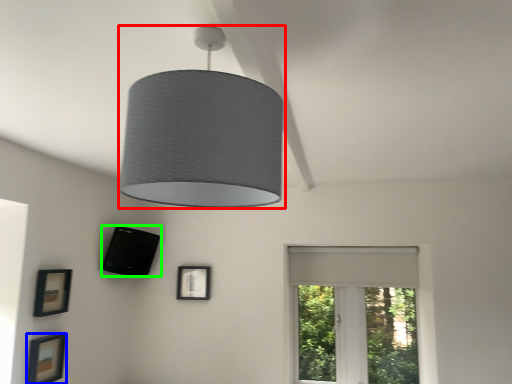
Question: Which object is the farthest from lamp (highlighted by a red box)? Choose among these: picture frame (highlighted by a blue box) or picture frame (highlighted by a green box).

Choices:
 (A) picture frame
 (B) picture frame

Answer: (B)